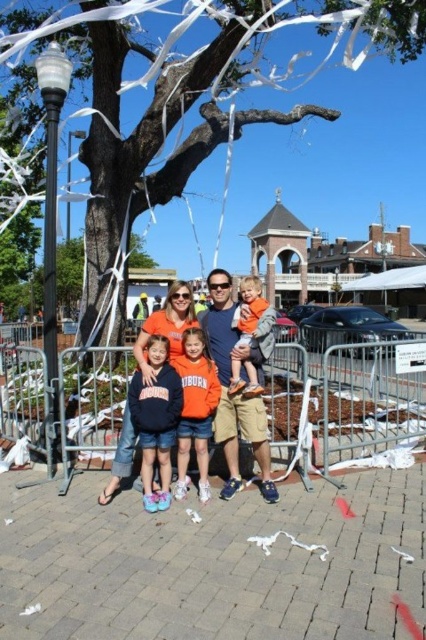
Does matte blue shirt at center appear over matte orange hoodie at center?

Incorrect, matte blue shirt at center is not positioned above matte orange hoodie at center.

Between matte blue shirt at center and matte orange hoodie at center, which one appears on the left side from the viewer's perspective?

From the viewer's perspective, matte blue shirt at center appears more on the left side.

This screenshot has width=426, height=640. What are the coordinates of `matte blue shirt at center` in the screenshot? It's located at (238, 392).

Identify the location of matte blue shirt at center. The height and width of the screenshot is (640, 426). (238, 392).

Between brown textured tree at upper center and black metal pole at left, which one is positioned higher?

brown textured tree at upper center is higher up.

Which of these two, brown textured tree at upper center or black metal pole at left, stands shorter?

black metal pole at left is shorter.

Is point (299, 26) more distant than point (48, 224)?

That is True.

At what (x,y) coordinates should I click in order to perform the action: click on brown textured tree at upper center. Please return your answer as a coordinate pair (x, y). This screenshot has width=426, height=640. Looking at the image, I should click on (190, 100).

Who is positioned more to the right, brown textured tree at upper center or orange cotton sweatshirt at center?

Positioned to the right is brown textured tree at upper center.

At what (x,y) coordinates should I click in order to perform the action: click on brown textured tree at upper center. Please return your answer as a coordinate pair (x, y). This screenshot has height=640, width=426. Looking at the image, I should click on (190, 100).